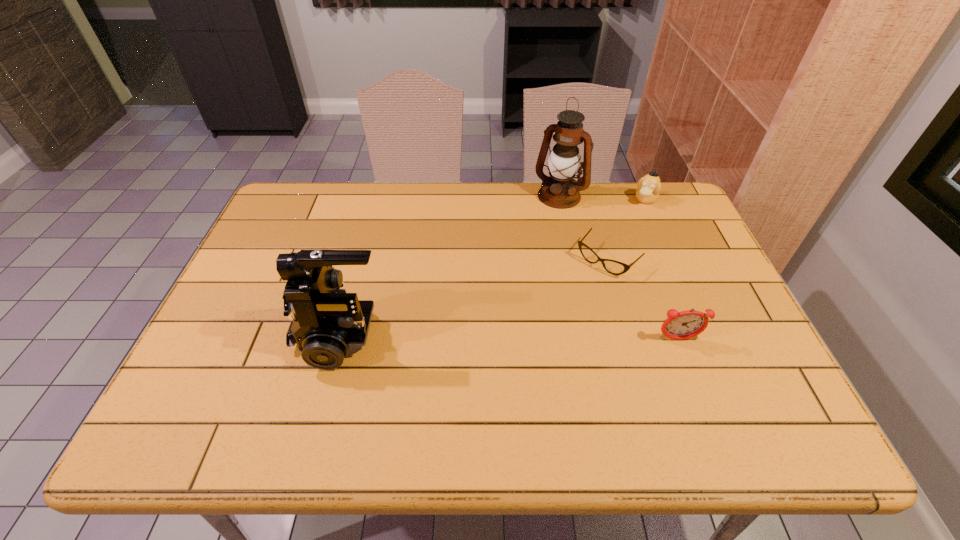
Where is `vacant space on the desktop that is between the camcorder and the alarm clock and is positioned on the front-facing side of the shortest object`? This screenshot has width=960, height=540. vacant space on the desktop that is between the camcorder and the alarm clock and is positioned on the front-facing side of the shortest object is located at coordinates (533, 338).

Where is `free space on the desktop that is between the fourth shortest object and the alarm clock and is positioned on the face of the duckling`? Image resolution: width=960 pixels, height=540 pixels. free space on the desktop that is between the fourth shortest object and the alarm clock and is positioned on the face of the duckling is located at coordinates (559, 338).

Find the location of a particular element. This screenshot has height=540, width=960. free space on the desktop that is between the fourth shortest object and the alarm clock and is positioned on the side of the tallest object, there is a wick adjustment knob is located at coordinates (459, 337).